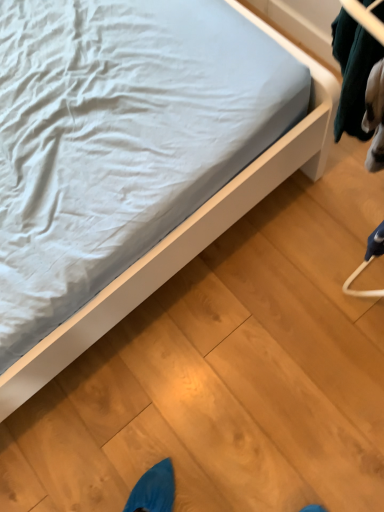
This screenshot has width=384, height=512. What do you see at coordinates (183, 236) in the screenshot? I see `white matte bed at upper left` at bounding box center [183, 236].

You are a GUI agent. You are given a task and a screenshot of the screen. Output one action in this format:
    pyautogui.click(x=<x>, y=<y>)
    Task: Click on the white matte bed at upper left
    
    Given the screenshot: What is the action you would take?
    pyautogui.click(x=183, y=236)

At what (x,y) coordinates should I click in order to perform the action: click on white matte bed at upper left. Please return your answer as a coordinate pair (x, y). The height and width of the screenshot is (512, 384). Looking at the image, I should click on (183, 236).